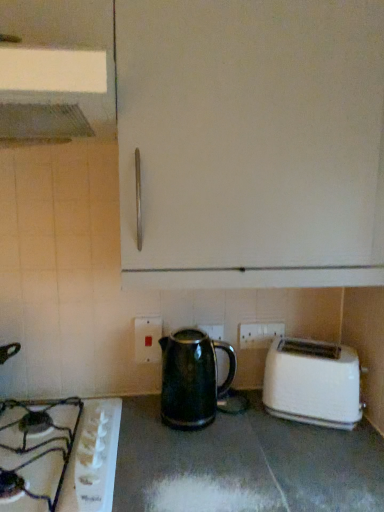
Where is `black ceramic gas stove at lower left`? Image resolution: width=384 pixels, height=512 pixels. black ceramic gas stove at lower left is located at coordinates (59, 454).

How much space does white plastic electric outlet at lower center, placed as the 1th electric outlet when sorted from front to back, occupy horizontally?

white plastic electric outlet at lower center, placed as the 1th electric outlet when sorted from front to back, is 2.23 centimeters wide.

Measure the distance between white plastic toaster at lower right and camera.

The distance of white plastic toaster at lower right from camera is 3.65 feet.

Describe the element at coordinates (244, 464) in the screenshot. Image resolution: width=384 pixels, height=512 pixels. I see `black glossy kettle at center` at that location.

The width and height of the screenshot is (384, 512). In order to click on white plastic electrical outlet at center, acting as the first electric outlet starting from the back in this screenshot , I will do `click(259, 334)`.

Image resolution: width=384 pixels, height=512 pixels. Identify the location of black ceramic gas stove at lower left. (59, 454).

Which is more to the right, white plastic electrical outlet at center, arranged as the 1th electric outlet when viewed from the right, or black ceramic gas stove at lower left?

Positioned to the right is white plastic electrical outlet at center, arranged as the 1th electric outlet when viewed from the right.

How far apart are white plastic electrical outlet at center, which is the second electric outlet from front to back, and black ceramic gas stove at lower left?

A distance of 23.50 inches exists between white plastic electrical outlet at center, which is the second electric outlet from front to back, and black ceramic gas stove at lower left.

Is white plastic electrical outlet at center, arranged as the 1th electric outlet when viewed from the right, not close to black ceramic gas stove at lower left?

That's not correct — white plastic electrical outlet at center, arranged as the 1th electric outlet when viewed from the right, is a little close to black ceramic gas stove at lower left.

From a real-world perspective, between black ceramic gas stove at lower left and green glossy kettle at center, who is vertically lower?

From a 3D spatial view, black ceramic gas stove at lower left is below.

In the image, is black ceramic gas stove at lower left on the left side or the right side of green glossy kettle at center?

Clearly, black ceramic gas stove at lower left is on the left of green glossy kettle at center in the image.

Locate an element on the screen. The width and height of the screenshot is (384, 512). gas stove on the left side of green glossy kettle at center is located at coordinates (59, 454).

Which is nearer, (0, 475) or (169, 412)?

Clearly, point (0, 475) is closer to the camera than point (169, 412).

Between point (50, 70) and point (28, 417), which one is positioned in front?

Point (50, 70)

Locate an element on the screen. The width and height of the screenshot is (384, 512). gas stove that is behind the metallic silver exhaust hood at upper left is located at coordinates [x=59, y=454].

Considering the relative sizes of metallic silver exhaust hood at upper left and black ceramic gas stove at lower left in the image provided, is metallic silver exhaust hood at upper left shorter than black ceramic gas stove at lower left?

Incorrect, the height of metallic silver exhaust hood at upper left does not fall short of that of black ceramic gas stove at lower left.

Is white plastic electrical outlet at center, acting as the first electric outlet starting from the back, oriented away from green glossy kettle at center?

No, white plastic electrical outlet at center, acting as the first electric outlet starting from the back, is not facing away from green glossy kettle at center.

How distant is white plastic electrical outlet at center, arranged as the 1th electric outlet when viewed from the right, from green glossy kettle at center?

white plastic electrical outlet at center, arranged as the 1th electric outlet when viewed from the right, is 9.00 inches away from green glossy kettle at center.

Based on their sizes in the image, would you say white plastic electrical outlet at center, which is the second electric outlet from front to back, is bigger or smaller than green glossy kettle at center?

Considering their sizes, white plastic electrical outlet at center, which is the second electric outlet from front to back, takes up less space than green glossy kettle at center.

Is white plastic toaster at lower right positioned before green glossy kettle at center?

That is False.

Is white plastic toaster at lower right at the left side of green glossy kettle at center?

No, white plastic toaster at lower right is not to the left of green glossy kettle at center.

From the image's perspective, does white plastic toaster at lower right appear lower than green glossy kettle at center?

Indeed, from the image's perspective, white plastic toaster at lower right is shown beneath green glossy kettle at center.

Does metallic silver exhaust hood at upper left appear on the right side of white plastic toaster at lower right?

In fact, metallic silver exhaust hood at upper left is to the left of white plastic toaster at lower right.

Are metallic silver exhaust hood at upper left and white plastic toaster at lower right making contact?

No, metallic silver exhaust hood at upper left is not in contact with white plastic toaster at lower right.

Between metallic silver exhaust hood at upper left and white plastic toaster at lower right, which one has larger width?

metallic silver exhaust hood at upper left is wider.

Is metallic silver exhaust hood at upper left bigger than white plastic toaster at lower right?

Indeed, metallic silver exhaust hood at upper left has a larger size compared to white plastic toaster at lower right.

From the image's perspective, is white plastic electrical outlet at center, acting as the first electric outlet starting from the back, below black glossy kettle at center?

Incorrect, from the image's perspective, white plastic electrical outlet at center, acting as the first electric outlet starting from the back, is higher than black glossy kettle at center.

Is white plastic electrical outlet at center, which is the second electric outlet from front to back, taller than black glossy kettle at center?

Incorrect, the height of white plastic electrical outlet at center, which is the second electric outlet from front to back, is not larger of that of black glossy kettle at center.

Considering the positions of objects white plastic electrical outlet at center, which is the second electric outlet from front to back, and black glossy kettle at center in the image provided, who is in front, white plastic electrical outlet at center, which is the second electric outlet from front to back, or black glossy kettle at center?

black glossy kettle at center.

Considering the sizes of objects white plastic electrical outlet at center, which is the second electric outlet from front to back, and black glossy kettle at center in the image provided, who is wider, white plastic electrical outlet at center, which is the second electric outlet from front to back, or black glossy kettle at center?

With larger width is black glossy kettle at center.

Find the location of a particular element. The image size is (384, 512). electric outlet that is the 2nd one when counting backward from the black ceramic gas stove at lower left is located at coordinates (259, 334).

The image size is (384, 512). Identify the location of kettle above the black ceramic gas stove at lower left (from a real-world perspective). (192, 378).

Considering their positions, is green glossy kettle at center positioned further to metallic silver exhaust hood at upper left than white plastic toaster at lower right?

white plastic toaster at lower right is positioned further to the anchor metallic silver exhaust hood at upper left.

Based on their spatial positions, is black glossy kettle at center or black ceramic gas stove at lower left further from green glossy kettle at center?

black ceramic gas stove at lower left.

From the image, which object appears to be farther from black ceramic gas stove at lower left, white plastic toaster at lower right or white plastic electrical outlet at center, which ranks as the second electric outlet in left-to-right order?

The object further to black ceramic gas stove at lower left is white plastic electrical outlet at center, which ranks as the second electric outlet in left-to-right order.

Considering their positions, is white plastic toaster at lower right positioned further to black glossy kettle at center than white plastic electric outlet at lower center, which is counted as the 2th electric outlet, starting from the right?

white plastic electric outlet at lower center, which is counted as the 2th electric outlet, starting from the right, is further to black glossy kettle at center.

Estimate the real-world distances between objects in this image. Which object is closer to black ceramic gas stove at lower left, metallic silver exhaust hood at upper left or white plastic toaster at lower right?

Based on the image, white plastic toaster at lower right appears to be nearer to black ceramic gas stove at lower left.

From the picture: When comparing their distances from black ceramic gas stove at lower left, does black glossy kettle at center or metallic silver exhaust hood at upper left seem further?

metallic silver exhaust hood at upper left is further to black ceramic gas stove at lower left.

Looking at the image, which one is located closer to white plastic electrical outlet at center, which is the second electric outlet from front to back, white plastic electric outlet at lower center, which is the second electric outlet from back to front, or black glossy kettle at center?

The object closer to white plastic electrical outlet at center, which is the second electric outlet from front to back, is white plastic electric outlet at lower center, which is the second electric outlet from back to front.

When comparing their distances from white plastic toaster at lower right, does green glossy kettle at center or black ceramic gas stove at lower left seem closer?

Based on the image, green glossy kettle at center appears to be nearer to white plastic toaster at lower right.

You are a GUI agent. You are given a task and a screenshot of the screen. Output one action in this format:
    pyautogui.click(x=<x>, y=<y>)
    Task: Click on the electric outlet located between black ceramic gas stove at lower left and white plastic electrical outlet at center, which is the second electric outlet from front to back, in the depth direction
    Image resolution: width=384 pixels, height=512 pixels.
    Given the screenshot: What is the action you would take?
    pyautogui.click(x=147, y=339)

Where is `toaster between green glossy kettle at center and black glossy kettle at center in the vertical direction`? toaster between green glossy kettle at center and black glossy kettle at center in the vertical direction is located at coordinates (313, 383).

You are a GUI agent. You are given a task and a screenshot of the screen. Output one action in this format:
    pyautogui.click(x=<x>, y=<y>)
    Task: Click on the counter top between black ceramic gas stove at lower left and white plastic toaster at lower right
    The height and width of the screenshot is (512, 384).
    Given the screenshot: What is the action you would take?
    pyautogui.click(x=244, y=464)

Locate an element on the screen. This screenshot has height=512, width=384. kettle between metallic silver exhaust hood at upper left and black ceramic gas stove at lower left in the vertical direction is located at coordinates (192, 378).